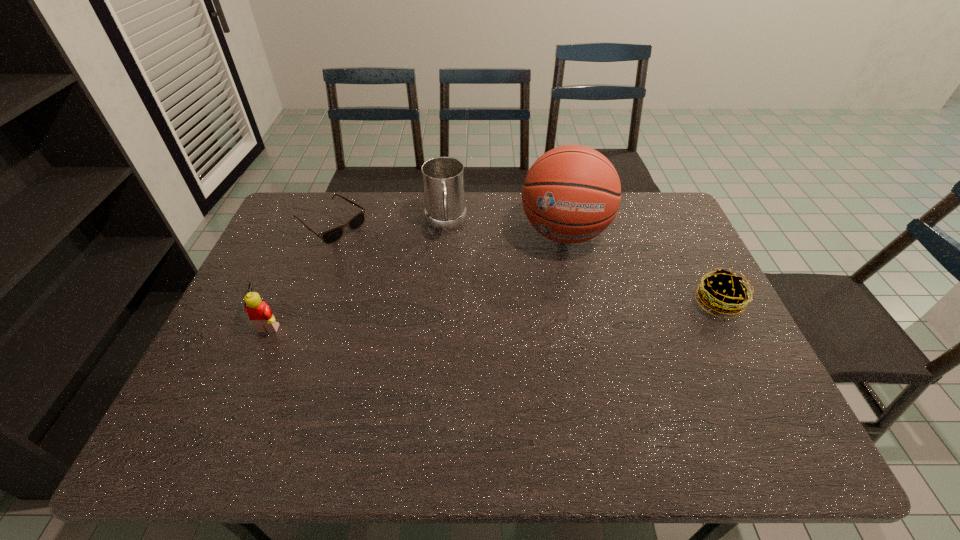
The image size is (960, 540). Identify the location of basketball situated at the far edge. (572, 193).

Locate an element on the screen. The width and height of the screenshot is (960, 540). mug that is positioned at the far edge is located at coordinates (443, 177).

You are a GUI agent. You are given a task and a screenshot of the screen. Output one action in this format:
    pyautogui.click(x=<x>, y=<y>)
    Task: Click on the sunglasses positioned at the far edge
    This screenshot has width=960, height=540.
    Given the screenshot: What is the action you would take?
    pyautogui.click(x=330, y=236)

You are a GUI agent. You are given a task and a screenshot of the screen. Output one action in this format:
    pyautogui.click(x=<x>, y=<y>)
    Task: Click on the Lego situated at the left edge
    
    Given the screenshot: What is the action you would take?
    pyautogui.click(x=260, y=314)

At what (x,y) coordinates should I click in order to perform the action: click on sunglasses present at the left edge. Please return your answer as a coordinate pair (x, y). Looking at the image, I should click on (330, 236).

This screenshot has height=540, width=960. I want to click on object situated at the right edge, so click(724, 293).

At what (x,y) coordinates should I click in order to perform the action: click on object positioned at the far left corner. Please return your answer as a coordinate pair (x, y). The height and width of the screenshot is (540, 960). Looking at the image, I should click on (330, 236).

This screenshot has height=540, width=960. What are the coordinates of `free space at the far edge` in the screenshot? It's located at (347, 220).

At what (x,y) coordinates should I click in order to perform the action: click on vacant space at the near edge of the desktop. Please return your answer as a coordinate pair (x, y). The image size is (960, 540). Looking at the image, I should click on (650, 401).

The width and height of the screenshot is (960, 540). In the image, there is a desktop. In order to click on free space at the left edge in this screenshot , I will do `click(244, 343)`.